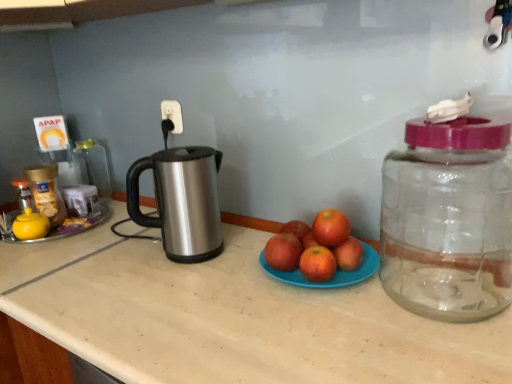
Question: Can you confirm if beige laminate countertop at center is smaller than red matte apple at center, which is the 2th apple from left to right?

Choices:
 (A) yes
 (B) no

Answer: (B)

Question: Is beige laminate countertop at center taller than red matte apple at center, which is the 2th apple from left to right?

Choices:
 (A) no
 (B) yes

Answer: (B)

Question: Does beige laminate countertop at center come in front of red matte apple at center, which is the 2th apple from left to right?

Choices:
 (A) no
 (B) yes

Answer: (B)

Question: From a real-world perspective, is beige laminate countertop at center beneath red matte apple at center, acting as the first apple starting from the right?

Choices:
 (A) yes
 (B) no

Answer: (A)

Question: Can you confirm if beige laminate countertop at center is positioned to the left of red matte apple at center, which is the 2th apple from left to right?

Choices:
 (A) yes
 (B) no

Answer: (A)

Question: Is beige laminate countertop at center oriented towards red matte apple at center, acting as the first apple starting from the right?

Choices:
 (A) yes
 (B) no

Answer: (B)

Question: Is orange matte grapefruit at center, which ranks as the 1th grapefruit in bottom-to-top order, located within transparent plastic jar at right, the first bottle positioned from the right?

Choices:
 (A) no
 (B) yes

Answer: (A)

Question: Is transparent plastic jar at right, which is the 3th bottle in back-to-front order, oriented away from orange matte grapefruit at center, which is the second grapefruit in top-to-bottom order?

Choices:
 (A) yes
 (B) no

Answer: (B)

Question: Is transparent plastic jar at right, the first bottle positioned from the right, closer to camera compared to orange matte grapefruit at center, which ranks as the 1th grapefruit in bottom-to-top order?

Choices:
 (A) yes
 (B) no

Answer: (A)

Question: Can we say transparent plastic jar at right, which is the 3th bottle in back-to-front order, lies outside orange matte grapefruit at center, which ranks as the 1th grapefruit in bottom-to-top order?

Choices:
 (A) yes
 (B) no

Answer: (A)

Question: Is transparent plastic jar at right, which is the 3th bottle in back-to-front order, bigger than orange matte grapefruit at center, which is the second grapefruit in top-to-bottom order?

Choices:
 (A) no
 (B) yes

Answer: (B)

Question: Does transparent plastic jar at right, which is the 3th bottle in back-to-front order, touch orange matte grapefruit at center, which ranks as the 1th grapefruit in bottom-to-top order?

Choices:
 (A) no
 (B) yes

Answer: (A)

Question: Does red matte apple at center, which is the first apple in left-to-right order, have a lesser height compared to transparent plastic bottle at left, acting as the second bottle starting from the right?

Choices:
 (A) no
 (B) yes

Answer: (B)